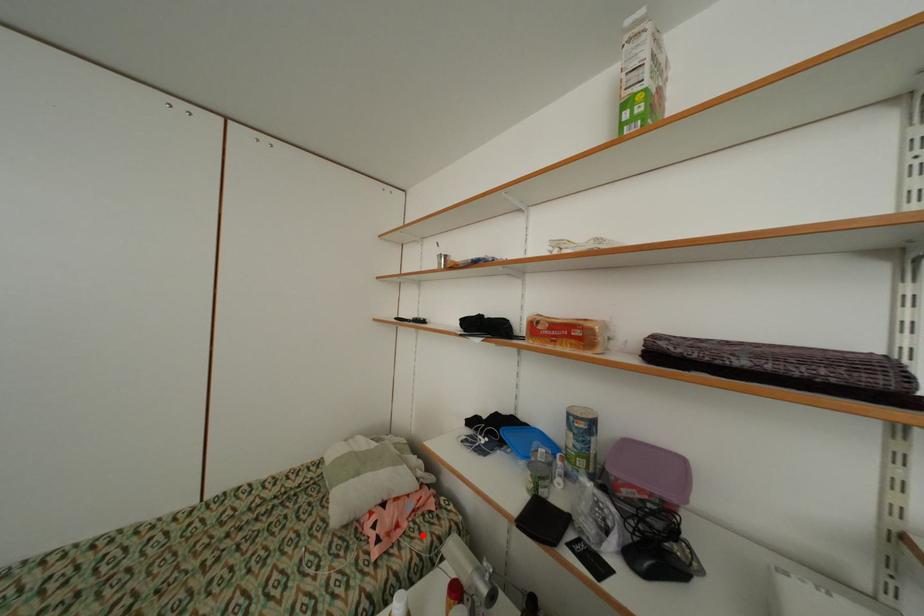
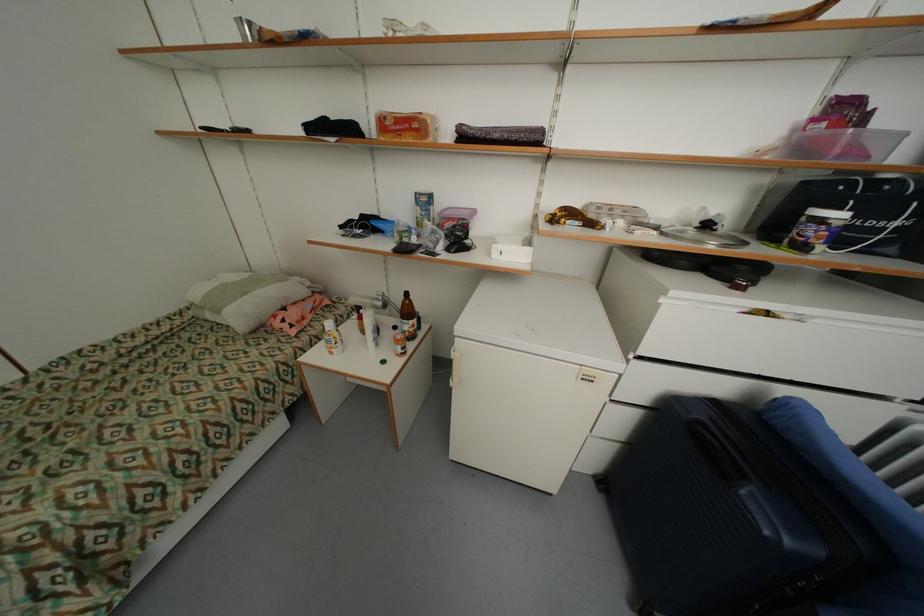
In the second image, find the point that corresponds to the highlighted location in the first image.

(327, 320)